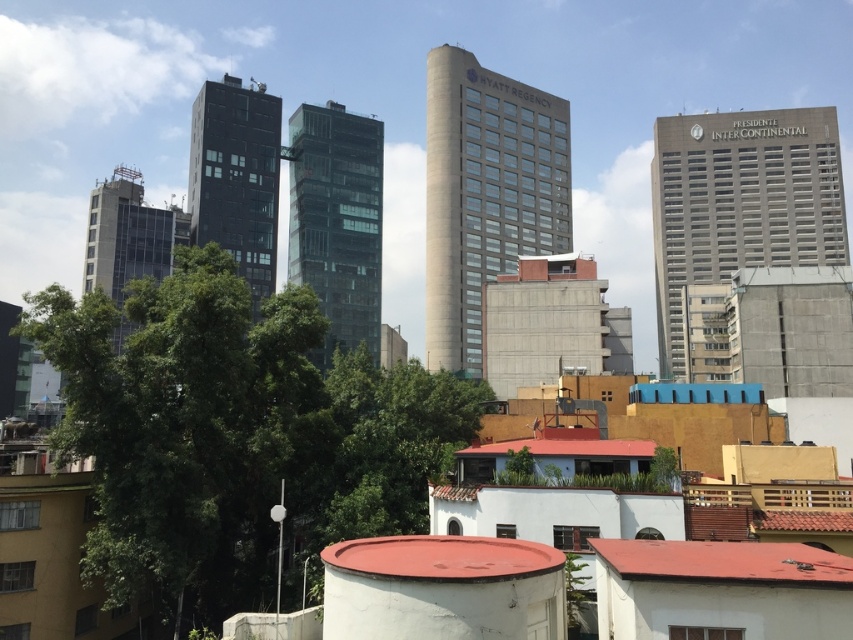
Can you confirm if green leafy tree at center is positioned to the right of glassy black building at center?

Indeed, green leafy tree at center is positioned on the right side of glassy black building at center.

Does green leafy tree at center lie behind glassy black building at center?

No.

Between point (186, 508) and point (360, 186), which one is positioned in front?

Positioned in front is point (186, 508).

Where is `green leafy tree at center`? green leafy tree at center is located at coordinates (233, 433).

Does point (498, 192) lie behind point (271, 125)?

That is True.

Does beige concrete tower at center lie behind black glass building at center?

That is True.

Between point (537, 97) and point (235, 259), which one is positioned behind?

Point (537, 97)

This screenshot has width=853, height=640. I want to click on beige concrete tower at center, so click(x=485, y=195).

Who is lower down, glassy black building at center or black glass building at center?

glassy black building at center

Does glassy black building at center have a lesser height compared to black glass building at center?

No, glassy black building at center is not shorter than black glass building at center.

Does point (364, 138) come closer to viewer compared to point (213, 240)?

No, (364, 138) is further to viewer.

Where is `glassy black building at center`? The image size is (853, 640). glassy black building at center is located at coordinates (337, 221).